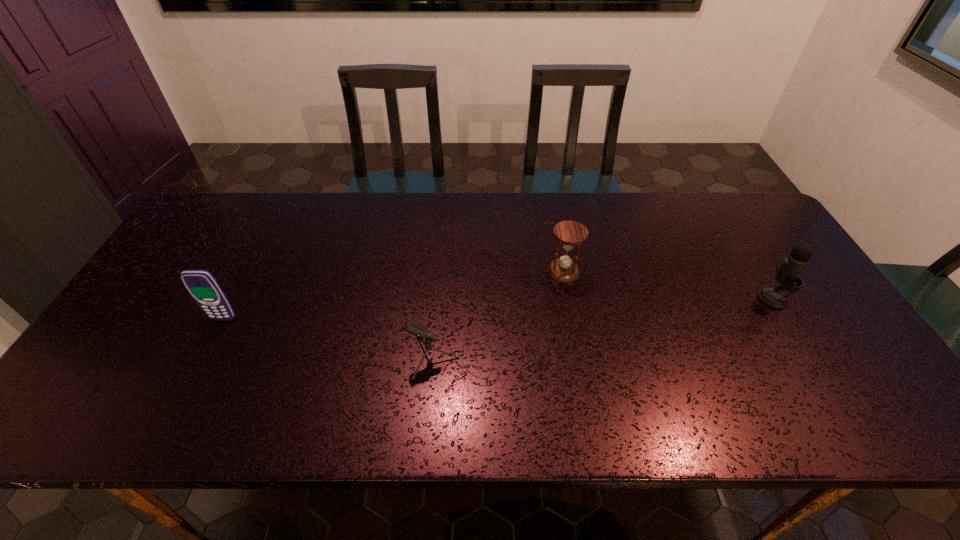
Locate an element on the screen. the rightmost object is located at coordinates (798, 258).

You are a GUI agent. You are given a task and a screenshot of the screen. Output one action in this format:
    pyautogui.click(x=<x>, y=<y>)
    Task: Click on the second farthest object
    The image size is (960, 540).
    Given the screenshot: What is the action you would take?
    pyautogui.click(x=798, y=258)

Where is `the leftmost object`? The width and height of the screenshot is (960, 540). the leftmost object is located at coordinates (202, 286).

Image resolution: width=960 pixels, height=540 pixels. I want to click on cellular telephone, so click(202, 286).

Find the location of a particular element. The height and width of the screenshot is (540, 960). the second object from right to left is located at coordinates (569, 233).

Identify the location of hourglass. This screenshot has width=960, height=540. (569, 233).

Locate an element on the screen. the left microphone is located at coordinates click(x=420, y=331).

What are the coordinates of `the shorter microphone` in the screenshot? It's located at (420, 331).

Where is `vacant space located on the back of the taller microphone`? vacant space located on the back of the taller microphone is located at coordinates (735, 235).

The width and height of the screenshot is (960, 540). I want to click on vacant space located 0.170m on the front-facing side of the cellular telephone, so click(192, 379).